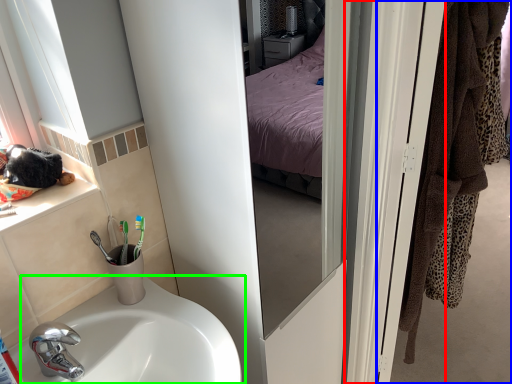
Question: Which object is the farthest from screen door (highlighted by a red box)? Choose among these: door (highlighted by a blue box) or sink (highlighted by a green box).

Choices:
 (A) door
 (B) sink

Answer: (A)